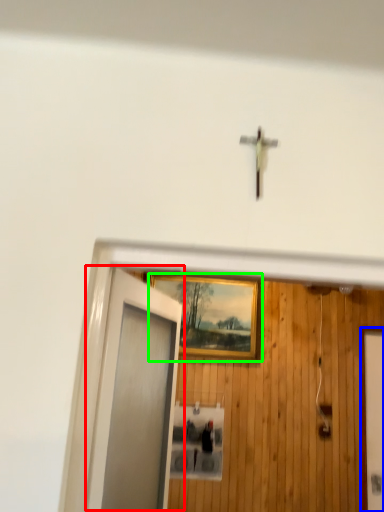
Question: Which object is the farthest from door (highlighted by a red box)? Choose among these: elevator door (highlighted by a blue box) or picture frame (highlighted by a green box).

Choices:
 (A) elevator door
 (B) picture frame

Answer: (A)